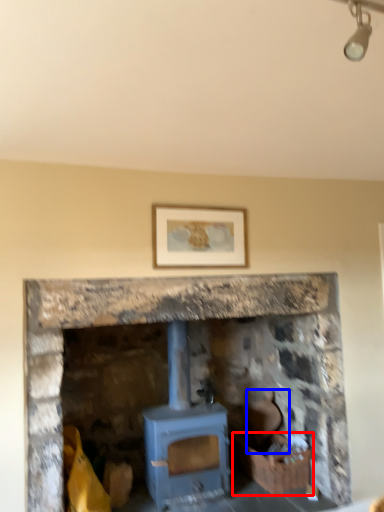
Question: Which object is further to the camera taking this photo, crate (highlighted by a red box) or chair (highlighted by a blue box)?

Choices:
 (A) crate
 (B) chair

Answer: (B)